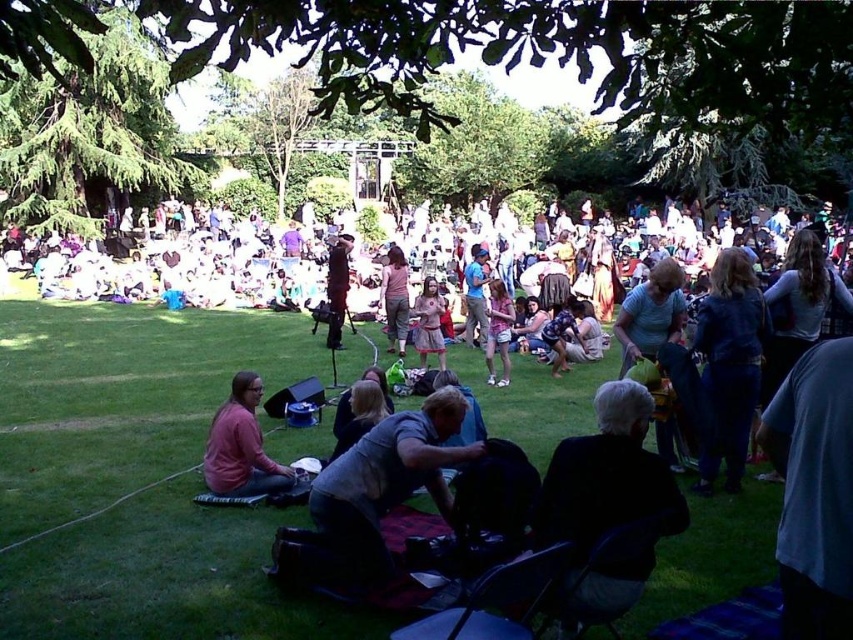
You are standing at the origin point of the coordinate system in the image. You want to place a new object at the same 2D location as the gray fabric bag at center. What coordinates should you use?

You should use the coordinates point (386, 483) to place the new object at the same 2D location as the gray fabric bag at center.

You are standing at the entrance of the park and see the pink fabric skirt at center. If you walk straight ahead, will the skirt come into your line of sight before reaching the stage?

The pink fabric skirt at center is located at point (395, 300), so yes, it will come into your line of sight before reaching the stage.